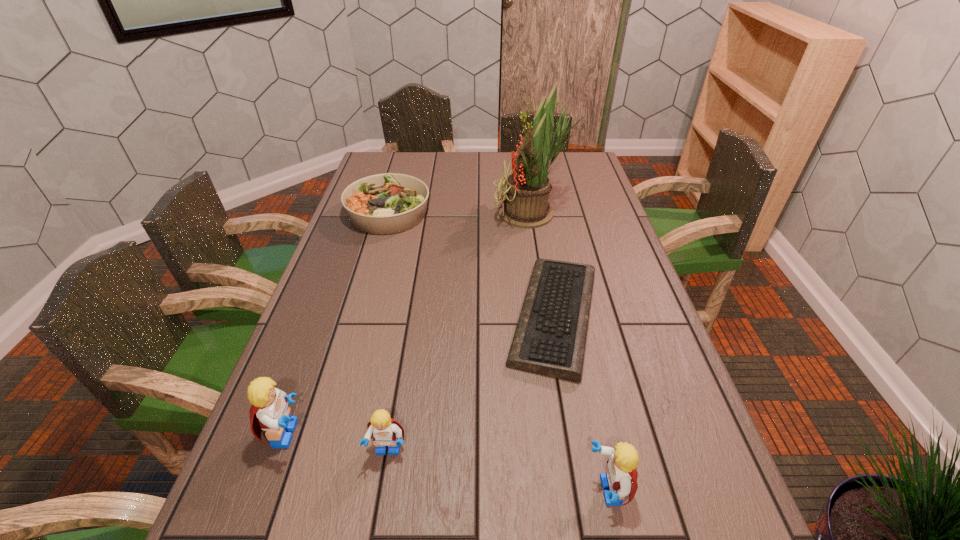
Identify the location of flower arrangement positioned at the right edge. This screenshot has height=540, width=960. pos(527,189).

Identify the location of computer keyboard that is at the right edge. The width and height of the screenshot is (960, 540). (550, 338).

The image size is (960, 540). Find the location of `vacant region at the near edge`. vacant region at the near edge is located at coordinates click(x=429, y=504).

Locate an element on the screen. The height and width of the screenshot is (540, 960). vacant space at the left edge is located at coordinates (343, 395).

In the image, there is a desktop. Where is `vacant space at the right edge`? vacant space at the right edge is located at coordinates (608, 211).

Where is `vacant area at the near right corner`? Image resolution: width=960 pixels, height=540 pixels. vacant area at the near right corner is located at coordinates (713, 484).

At what (x,y) coordinates should I click in order to perform the action: click on free point between the fourth tallest object and the flower arrangement. Please return your answer as a coordinate pair (x, y). Looking at the image, I should click on (460, 333).

Where is `empty location between the third shortest object and the fourth nearest object`? This screenshot has width=960, height=540. empty location between the third shortest object and the fourth nearest object is located at coordinates (471, 384).

At what (x,y) coordinates should I click in order to perform the action: click on vacant space that is in between the leftmost Lego and the shortest Lego. Please return your answer as a coordinate pair (x, y). Looking at the image, I should click on (338, 442).

Identify the location of free space between the salad plate and the flower arrangement. (461, 213).